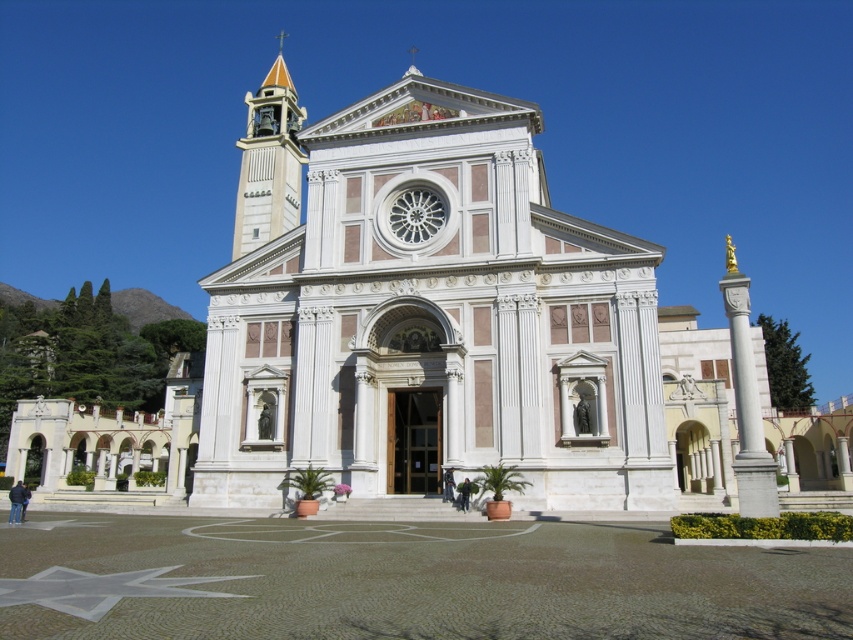
Is matte orange bell tower at upper left behind black leather jacket at center?

Yes, matte orange bell tower at upper left is further from the viewer.

Does point (265, 212) come in front of point (445, 496)?

No, it is behind (445, 496).

Locate an element on the screen. Image resolution: width=853 pixels, height=640 pixels. matte orange bell tower at upper left is located at coordinates (270, 161).

Which is above, dark blue jacket at lower left or dark gray fabric jacket at lower center?

Positioned higher is dark gray fabric jacket at lower center.

Which is behind, point (13, 486) or point (460, 496)?

The point (13, 486) is more distant.

Which is in front, point (19, 488) or point (463, 493)?

Positioned in front is point (19, 488).

Locate an element on the screen. The width and height of the screenshot is (853, 640). dark blue jacket at lower left is located at coordinates (16, 500).

Is matte orange bell tower at upper left bigger than dark blue jacket at lower left?

Indeed, matte orange bell tower at upper left has a larger size compared to dark blue jacket at lower left.

Find the location of a particular element. The height and width of the screenshot is (640, 853). matte orange bell tower at upper left is located at coordinates (270, 161).